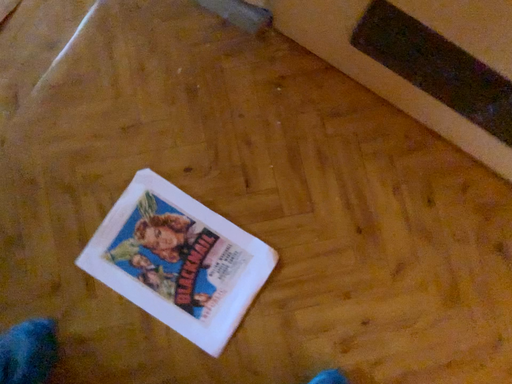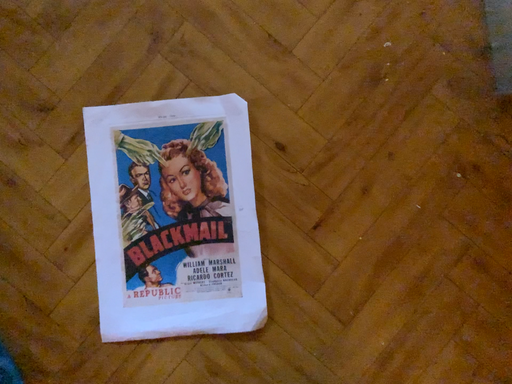
Question: Which way did the camera rotate in the video?

Choices:
 (A) rotated left
 (B) rotated right

Answer: (A)